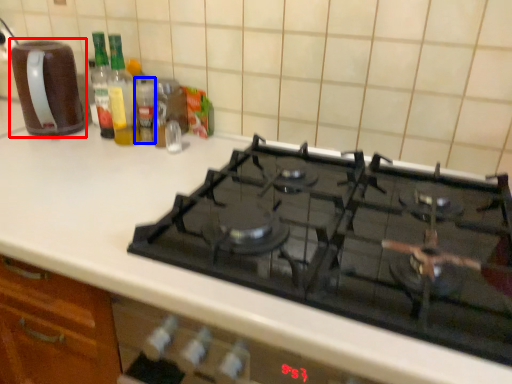
Question: Among these objects, which one is nearest to the camera, kitchen appliance (highlighted by a red box) or bottle (highlighted by a blue box)?

Choices:
 (A) kitchen appliance
 (B) bottle

Answer: (A)